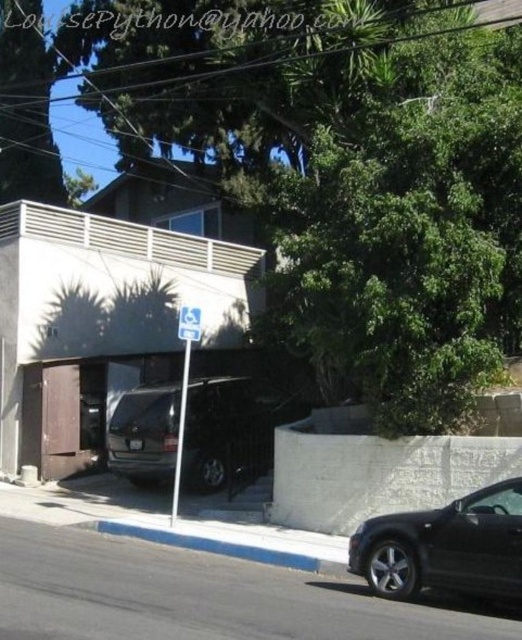
You are a delivery driver who needs to park your vehicle in the residential area shown. You see a point marked at coordinates (445, 547) which indicates the location of a black matte car at lower right. Is there enough space between the curb and the building to park your vehicle?

The point at coordinates (445, 547) marks the location of the black matte car at lower right. Since the curb is designated for disabled parking and the building has a garage door partially open with a van inside, there might not be sufficient space between the curb and the building to park your vehicle safely.

You are standing at the curb in the residential street scene. There are two points marked on the image. The first point is at coordinates point (x=493, y=577) and the second point is at point (x=256, y=552). Which point is closer to you?

Point (x=493, y=577) is in front of point (x=256, y=552), so it is closer to you.